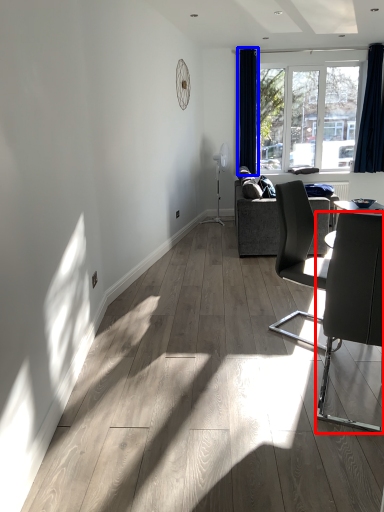
Question: Among these objects, which one is nearest to the camera, chair (highlighted by a red box) or curtain (highlighted by a blue box)?

Choices:
 (A) chair
 (B) curtain

Answer: (A)